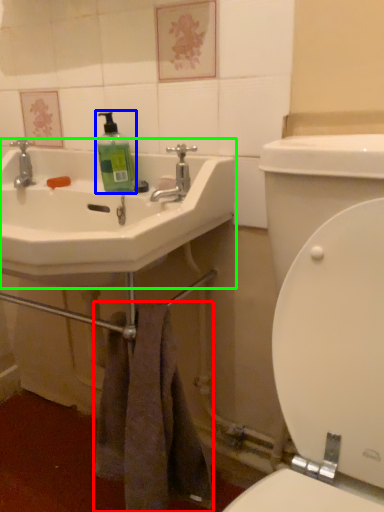
Question: Which is nearer to the towel/napkin (highlighted by a red box)? cleaning product (highlighted by a blue box) or sink (highlighted by a green box).

Choices:
 (A) cleaning product
 (B) sink

Answer: (B)